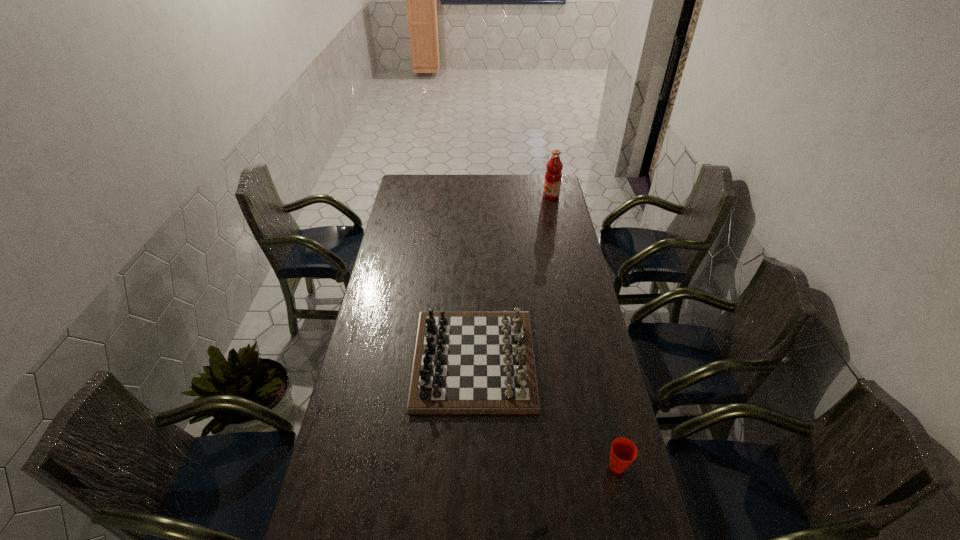
Identify the location of fruit juice positioned at the right edge. (553, 176).

You are a GUI agent. You are given a task and a screenshot of the screen. Output one action in this format:
    pyautogui.click(x=<x>, y=<y>)
    Task: Click on the cup at the right edge
    The height and width of the screenshot is (540, 960).
    Given the screenshot: What is the action you would take?
    pyautogui.click(x=623, y=452)

At what (x,y) coordinates should I click in order to perform the action: click on object that is at the far right corner. Please return your answer as a coordinate pair (x, y). Looking at the image, I should click on (553, 176).

The width and height of the screenshot is (960, 540). Find the location of `vacant space at the far edge of the desktop`. vacant space at the far edge of the desktop is located at coordinates (495, 180).

Identify the location of free location at the left edge of the desktop. The image size is (960, 540). (384, 291).

The image size is (960, 540). In the image, there is a desktop. Identify the location of vacant space at the right edge. (579, 392).

The image size is (960, 540). Identify the location of free spot between the second farthest object and the cup. (545, 413).

This screenshot has height=540, width=960. I want to click on unoccupied position between the third nearest object and the third farthest object, so click(545, 413).

Where is `empty space between the farthest object and the cup`? empty space between the farthest object and the cup is located at coordinates pos(584,331).

What are the coordinates of `free space between the tallest object and the second farthest object` in the screenshot? It's located at (513, 278).